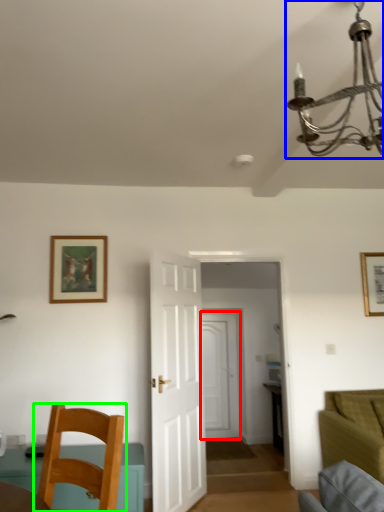
Question: Considering the real-world distances, which object is farthest from door (highlighted by a red box)? light fixture (highlighted by a blue box) or chair (highlighted by a green box)?

Choices:
 (A) light fixture
 (B) chair

Answer: (A)